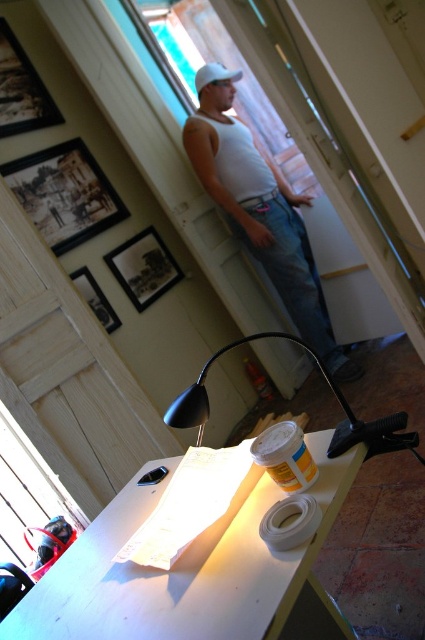
Can you confirm if white matte table at lower center is positioned above wooden framed picture at upper left?

Incorrect, white matte table at lower center is not positioned above wooden framed picture at upper left.

Who is more distant from viewer, (339, 616) or (115, 212)?

The point (115, 212) is behind.

The height and width of the screenshot is (640, 425). In order to click on white matte table at lower center in this screenshot , I will do `click(193, 572)`.

Between white matte tank top at center and black plastic lamp at lower center, which one appears on the left side from the viewer's perspective?

Positioned to the left is black plastic lamp at lower center.

Describe the element at coordinates (263, 218) in the screenshot. I see `white matte tank top at center` at that location.

Where is `white matte tank top at center`? white matte tank top at center is located at coordinates (263, 218).

Does white matte tank top at center appear on the left side of wooden framed picture at upper left?

No, white matte tank top at center is not to the left of wooden framed picture at upper left.

Does white matte tank top at center appear under wooden framed picture at upper left?

Indeed, white matte tank top at center is positioned under wooden framed picture at upper left.

Locate an element on the screen. This screenshot has height=640, width=425. white matte tank top at center is located at coordinates (263, 218).